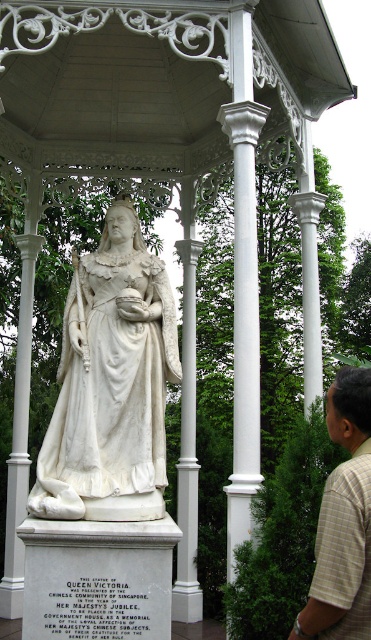
Question: Which object is positioned farthest from the light brown plaid shirt at lower right?

Choices:
 (A) white marble statue at center
 (B) white marble column at center

Answer: (A)

Question: Is white marble statue at center bigger than white marble column at center?

Choices:
 (A) yes
 (B) no

Answer: (B)

Question: Is white marble column at center positioned before light brown plaid shirt at lower right?

Choices:
 (A) yes
 (B) no

Answer: (B)

Question: Does white marble column at center appear on the right side of light brown plaid shirt at lower right?

Choices:
 (A) no
 (B) yes

Answer: (A)

Question: Which object is closer to the camera taking this photo?

Choices:
 (A) white marble column at center
 (B) light brown plaid shirt at lower right
 (C) white marble statue at center

Answer: (B)

Question: Among these points, which one is nearest to the camera?

Choices:
 (A) (162, 426)
 (B) (247, 104)

Answer: (B)